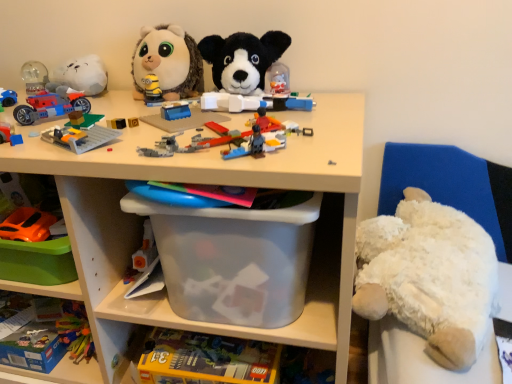
Where is `vacant area that lies between translucent plastic lego pieces at center, acting as the 4th toy starting from the top, and black plush dog at center, the 2th toy from the top`? vacant area that lies between translucent plastic lego pieces at center, acting as the 4th toy starting from the top, and black plush dog at center, the 2th toy from the top is located at coordinates (262, 110).